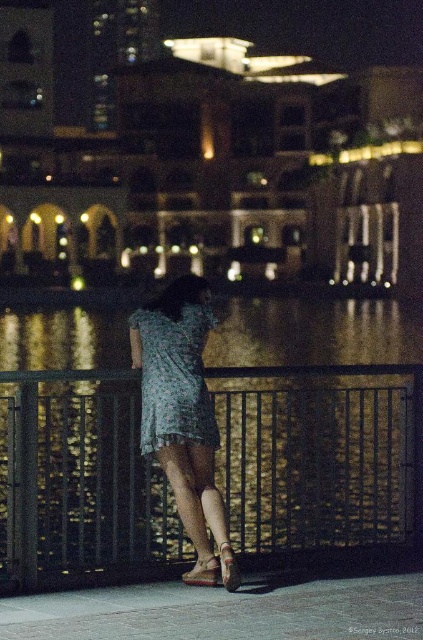
Is black metal fence at center smaller than leather textured sandal at lower center?

No.

Between black metal fence at center and leather textured sandal at lower center, which one has more height?

Standing taller between the two is black metal fence at center.

Who is more forward, (52,540) or (184,572)?

Positioned in front is point (184,572).

Where is `black metal fence at center`? This screenshot has height=640, width=423. black metal fence at center is located at coordinates (321, 458).

Can you confirm if printed fabric dress at center is smaller than green floral dress at center?

No, printed fabric dress at center is not smaller than green floral dress at center.

Can you confirm if printed fabric dress at center is wider than green floral dress at center?

Yes.

Between point (167, 291) and point (184, 369), which one is positioned behind?

Positioned behind is point (167, 291).

Locate an element on the screen. The width and height of the screenshot is (423, 640). printed fabric dress at center is located at coordinates (180, 403).

Find the location of `black metal fence at center`. black metal fence at center is located at coordinates (321, 458).

This screenshot has width=423, height=640. Describe the element at coordinates (321, 458) in the screenshot. I see `black metal fence at center` at that location.

Does point (285, 436) come behind point (220, 561)?

Yes.

Where is `black metal fence at center`? The height and width of the screenshot is (640, 423). black metal fence at center is located at coordinates (321, 458).